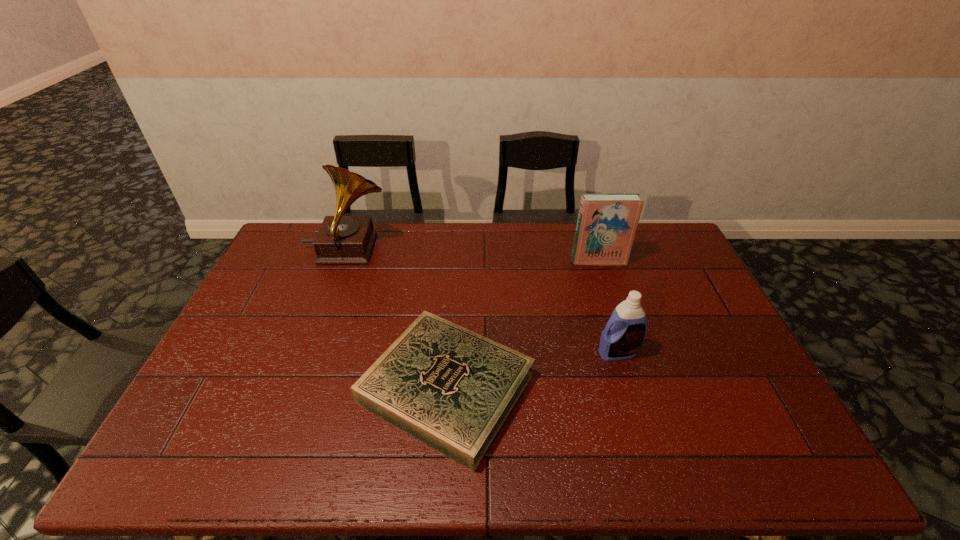
Image resolution: width=960 pixels, height=540 pixels. In order to click on the tallest object in this screenshot , I will do `click(341, 239)`.

This screenshot has height=540, width=960. I want to click on phonograph record, so click(341, 239).

At what (x,y) coordinates should I click in order to perform the action: click on the taller hardback book. Please return your answer as a coordinate pair (x, y). This screenshot has width=960, height=540. Looking at the image, I should click on (606, 226).

At what (x,y) coordinates should I click in order to perform the action: click on the farther hardback book. Please return your answer as a coordinate pair (x, y). Looking at the image, I should click on (606, 226).

Locate an element on the screen. the second shortest object is located at coordinates (624, 333).

The width and height of the screenshot is (960, 540). Find the location of `the second object from left to right`. the second object from left to right is located at coordinates (451, 388).

You are a GUI agent. You are given a task and a screenshot of the screen. Output one action in this format:
    pyautogui.click(x=<x>, y=<y>)
    Task: Click on the shorter hardback book
    This screenshot has height=540, width=960.
    Given the screenshot: What is the action you would take?
    pyautogui.click(x=451, y=388)

Where is `vacant area located from the horn of the phonograph record`? This screenshot has height=540, width=960. vacant area located from the horn of the phonograph record is located at coordinates (438, 251).

In order to click on vacant space located 0.350m on the cover of the right hardback book in this screenshot , I will do `click(625, 343)`.

This screenshot has width=960, height=540. Find the location of `vacant region located 0.200m on the back of the second shortest object`. vacant region located 0.200m on the back of the second shortest object is located at coordinates (601, 296).